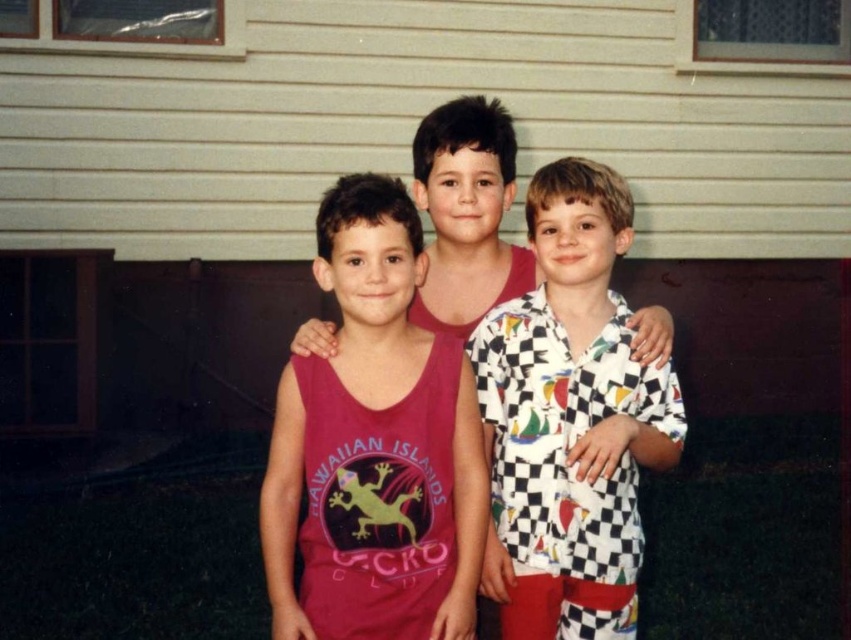
You are a photographer standing 2 meters away from the matte pink tank top at center. Can you reach it with your 1.8 meter long extendable pole?

The distance between the matte pink tank top at center and the camera is 1.92 meters. Since the extendable pole is only 1.8 meters long, you cannot reach the matte pink tank top at center with it.